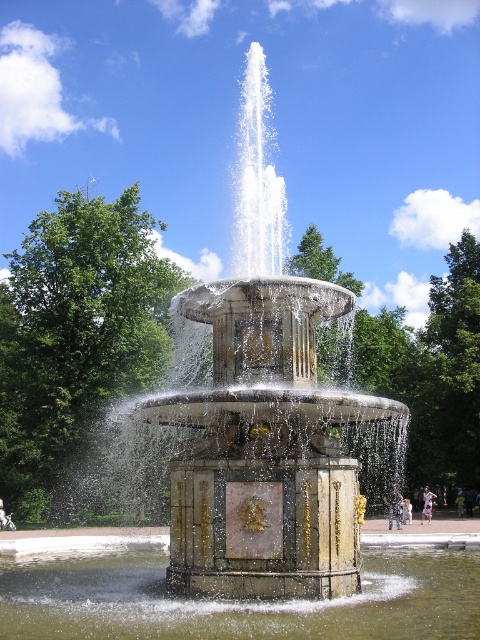
Question: Does white marble fountain at center appear over clear water at fountain center?

Choices:
 (A) yes
 (B) no

Answer: (A)

Question: Does white marble fountain at center appear on the right side of clear water at fountain center?

Choices:
 (A) no
 (B) yes

Answer: (B)

Question: Is white marble fountain at center closer to camera compared to clear water at fountain center?

Choices:
 (A) yes
 (B) no

Answer: (B)

Question: Which of the following is the farthest from the observer?

Choices:
 (A) clear water at fountain center
 (B) white marble fountain at center

Answer: (B)

Question: Which point is farther to the camera?

Choices:
 (A) white marble fountain at center
 (B) clear water at fountain center

Answer: (A)